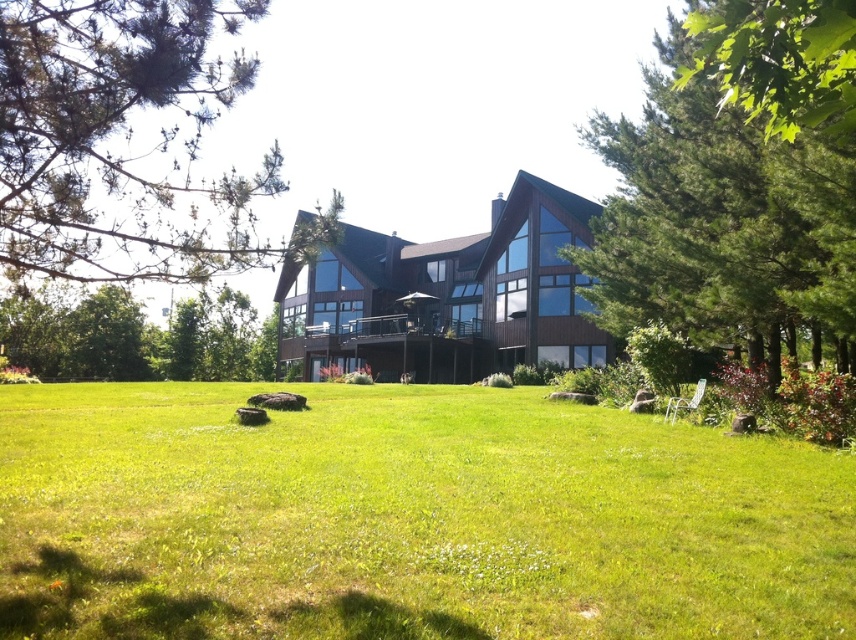
Can you confirm if green needle-like leaves at upper left is positioned to the right of green leafy tree at lower left?

Correct, you'll find green needle-like leaves at upper left to the right of green leafy tree at lower left.

Is green needle-like leaves at upper left positioned at the back of green leafy tree at lower left?

No, green needle-like leaves at upper left is closer to the viewer.

Identify the location of green needle-like leaves at upper left. (128, 144).

Which is more to the left, green leafy tree at right or green needle-like leaves at upper left?

Positioned to the left is green needle-like leaves at upper left.

Who is taller, green leafy tree at right or green needle-like leaves at upper left?

With more height is green leafy tree at right.

Is point (694, 22) more distant than point (105, 131)?

Yes.

Find the location of a particular element. The width and height of the screenshot is (856, 640). green leafy tree at right is located at coordinates (736, 179).

What do you see at coordinates (736, 179) in the screenshot?
I see `green leafy tree at right` at bounding box center [736, 179].

Between green leafy tree at right and green leafy tree at upper right, which one appears on the left side from the viewer's perspective?

green leafy tree at upper right is more to the left.

The width and height of the screenshot is (856, 640). What are the coordinates of `green leafy tree at right` in the screenshot? It's located at pyautogui.click(x=736, y=179).